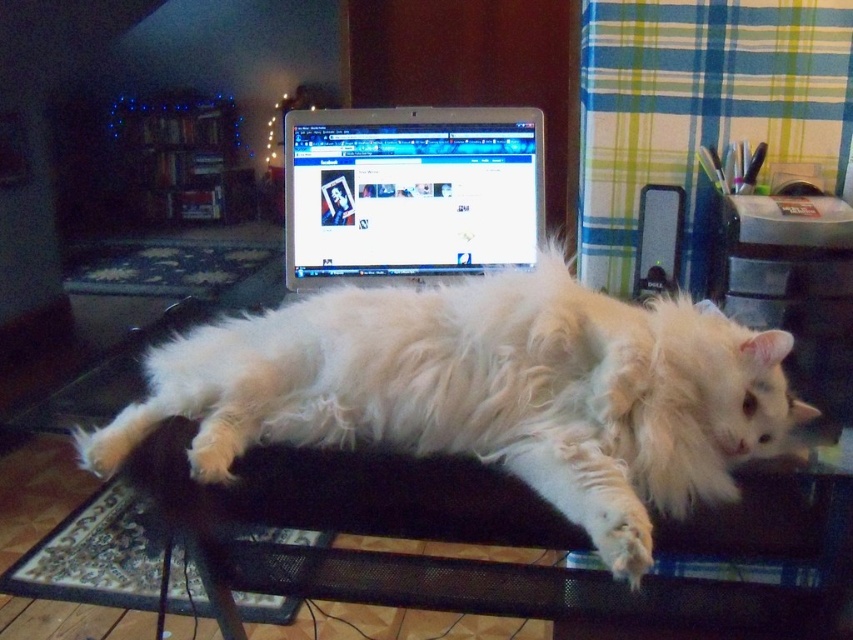
You are trying to take a photo of the laptop screen in the image. The white fluffy cat at center is blocking the view. Where should you move the cat to so that the laptop screen is visible?

You should move the white fluffy cat at center to the left side of the laptop since the cat is currently at point (486, 392) which is to the right of the laptop positioned centrally behind the cat.

Looking at this image, you are a photographer trying to take a clear picture of the white fluffy cat at center without the black mesh table at center appearing in the background. Is the distance between them sufficient to blur the table using a standard camera lens with a focal length of 50mm and an aperture of f2.8?

The distance between the white fluffy cat at center and the black mesh table at center is 15.89 centimeters. With a 50mm lens at f2.8, the depth of field would likely keep both the cat and the table in focus at this close distance, so the table may still be visible in the background.

You are a photographer trying to capture the cat in the image. You want to focus on the point closest to the camera. Which point should you choose between point (546, 252) and point (434, 252)?

Point (546, 252) is closer to the camera than point (434, 252), so you should choose point (546, 252) to focus on the cat.